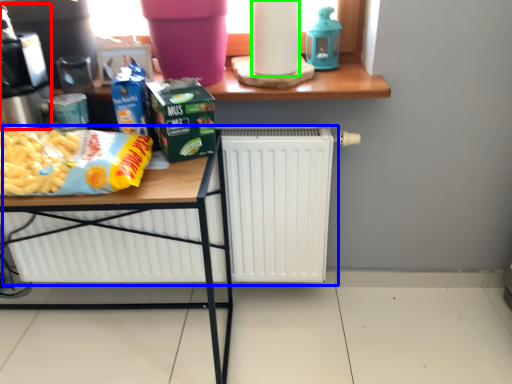
Question: Which object is positioned closest to coffee machine (highlighted by a red box)? Select from radiator (highlighted by a blue box) and paper towel (highlighted by a green box).

Choices:
 (A) radiator
 (B) paper towel

Answer: (B)